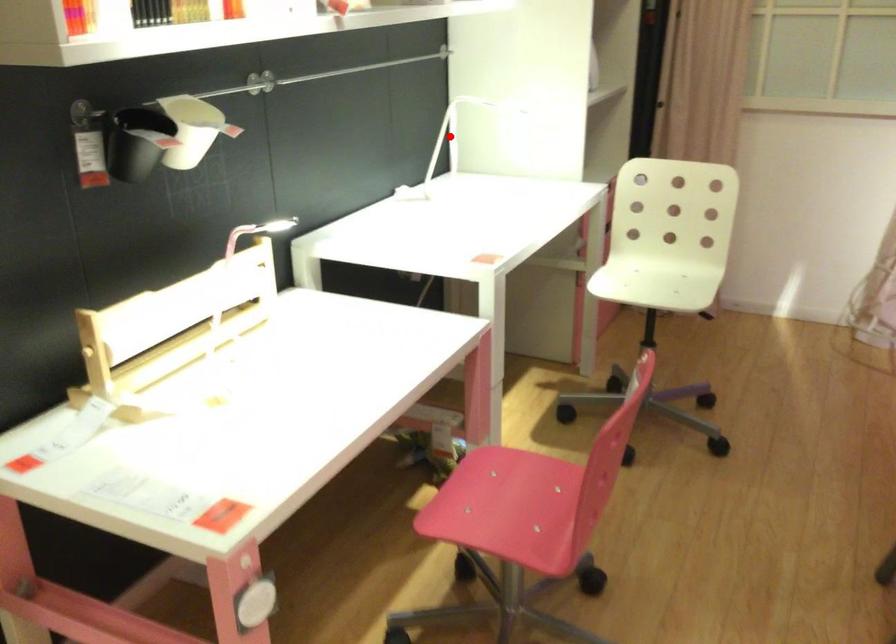
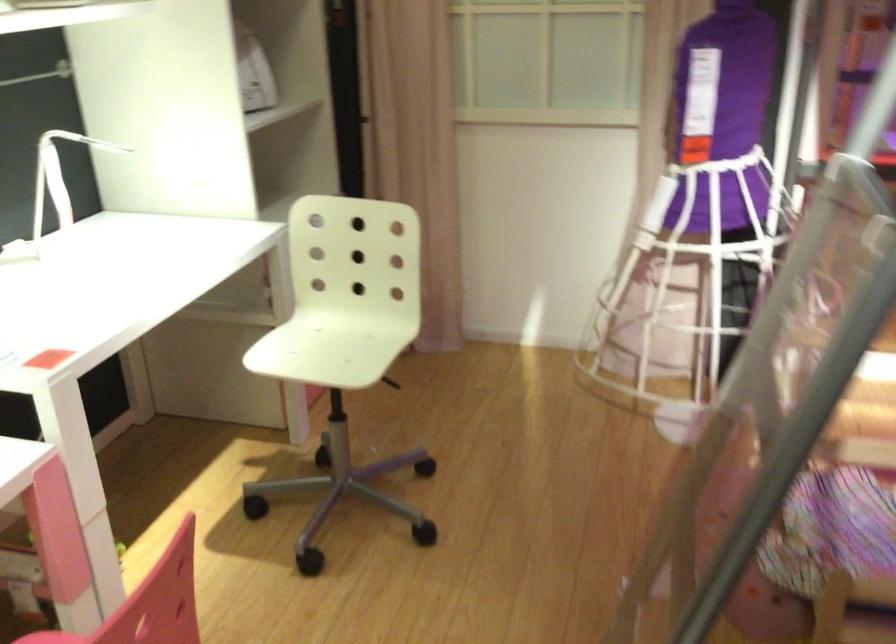
Question: I am providing you with two images of the same scene from different viewpoints. A red point is shown in image1. For the corresponding object point in image2, is it positioned nearer or farther from the camera?

Choices:
 (A) Nearer
 (B) Farther

Answer: (A)